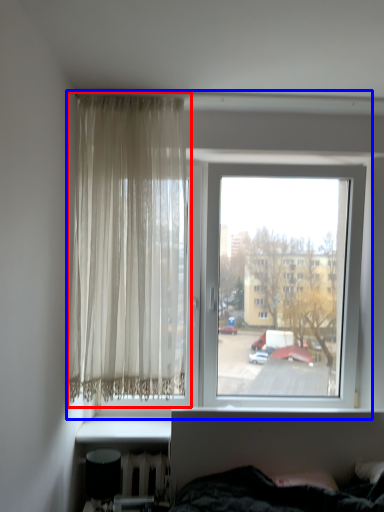
Question: Which point is closer to the camera, curtain (highlighted by a red box) or window (highlighted by a blue box)?

Choices:
 (A) curtain
 (B) window

Answer: (A)